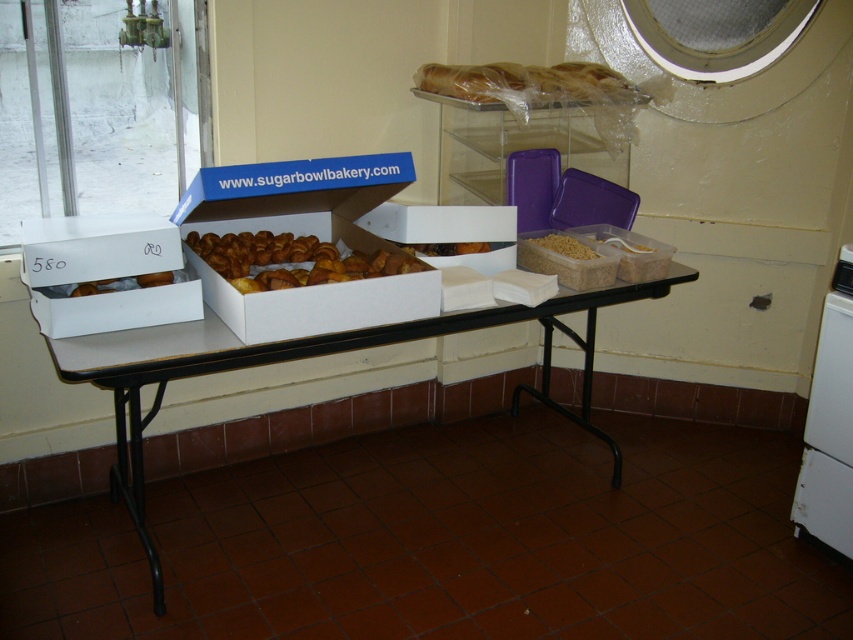
Does white cardboard box at center appear over white plastic refrigerator at lower right?

Indeed, white cardboard box at center is positioned over white plastic refrigerator at lower right.

Based on the photo, can you confirm if white cardboard box at center is shorter than white plastic refrigerator at lower right?

Correct, white cardboard box at center is not as tall as white plastic refrigerator at lower right.

Where is `white cardboard box at center`? The width and height of the screenshot is (853, 640). white cardboard box at center is located at coordinates (294, 196).

Measure the distance between point [839,262] and camera.

Point [839,262] and camera are 7.08 feet apart.

Can you confirm if white plastic refrigerator at lower right is positioned above golden brown bread at upper center?

Actually, white plastic refrigerator at lower right is below golden brown bread at upper center.

I want to click on white plastic refrigerator at lower right, so [828, 422].

This screenshot has height=640, width=853. What do you see at coordinates (105, 273) in the screenshot?
I see `white cardboard box at left` at bounding box center [105, 273].

Between white cardboard box at left and golden brown doughnut at center, which one is positioned higher?

white cardboard box at left is above.

Who is more forward, (x=96, y=266) or (x=247, y=278)?

Point (x=96, y=266) is more forward.

You are a GUI agent. You are given a task and a screenshot of the screen. Output one action in this format:
    pyautogui.click(x=<x>, y=<y>)
    Task: Click on the white cardboard box at left
    Image resolution: width=853 pixels, height=640 pixels.
    Given the screenshot: What is the action you would take?
    pyautogui.click(x=105, y=273)